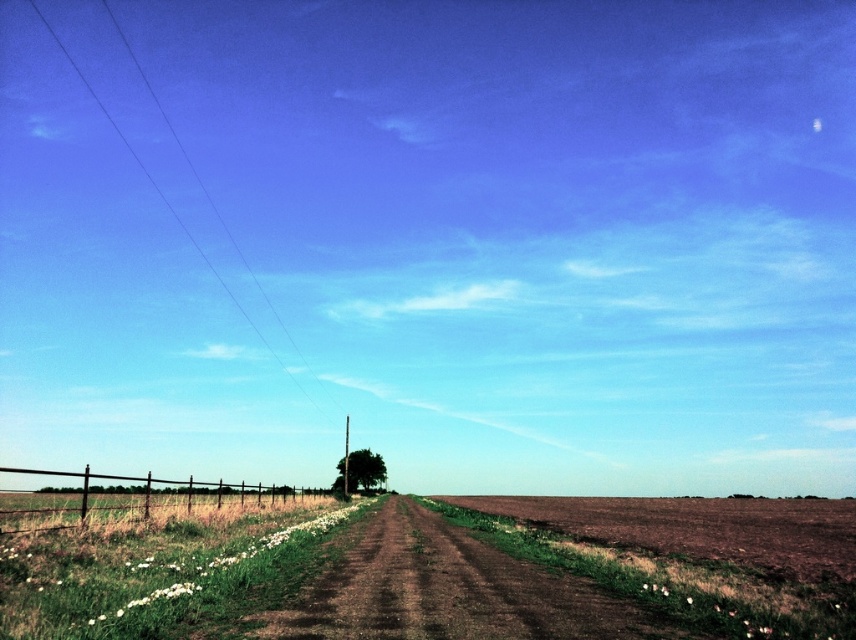
You are standing at the starting point of the dirt road in the foreground. You see two points marked on the road ahead of you. The first point is at coordinates point (699, 614) and the second is at point (46, 529). Which of these points is closer to you as you stand at the starting point?

Point (699, 614) is in front of point (46, 529), so the first point is closer to you.

You are a hiker standing on the brown soil at center and want to reach the brown wooden fence at left. Which direction should you move to get there?

You should move downward to reach the brown wooden fence at left because the brown soil at center is located above it.

You are standing on the dirt road in the foreground of the rural landscape. You notice the brown wooden fence at left and the green leafy tree at center. Which object is taller?

The brown wooden fence at left is taller than the green leafy tree at center.